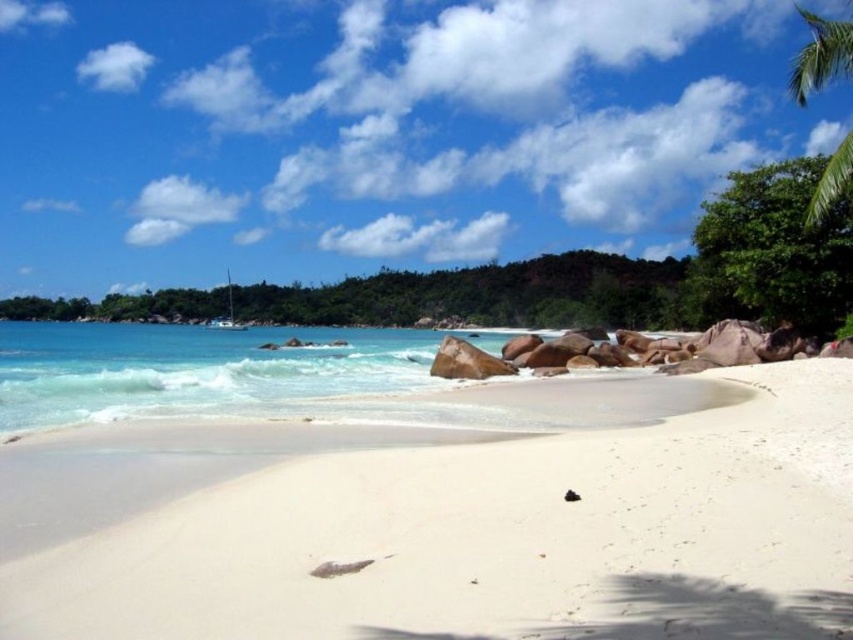
Question: Among these points, which one is farthest from the camera?

Choices:
 (A) (294, 595)
 (B) (427, 369)

Answer: (B)

Question: Which object is closer to the camera taking this photo?

Choices:
 (A) clear blue water at lower left
 (B) green leafy palm tree at upper right
 (C) white sandy beach at center

Answer: (C)

Question: Which object is positioned closest to the white sandy beach at center?

Choices:
 (A) clear blue water at lower left
 (B) green leafy palm tree at upper right

Answer: (B)

Question: Is clear blue water at lower left bigger than green leafy palm tree at upper right?

Choices:
 (A) no
 (B) yes

Answer: (A)

Question: Can you confirm if white sandy beach at center is smaller than green leafy palm tree at upper right?

Choices:
 (A) yes
 (B) no

Answer: (A)

Question: Observing the image, what is the correct spatial positioning of clear blue water at lower left in reference to green leafy palm tree at upper right?

Choices:
 (A) left
 (B) right

Answer: (A)